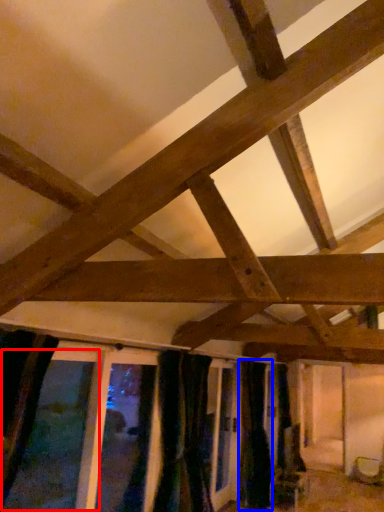
Question: Which point is closer to the camera, window (highlighted by a red box) or curtain (highlighted by a blue box)?

Choices:
 (A) window
 (B) curtain

Answer: (A)